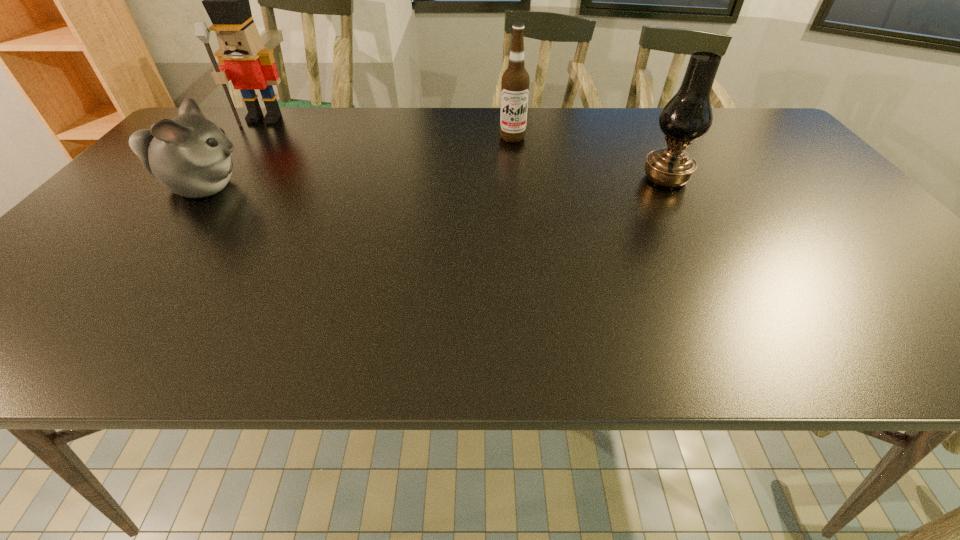
This screenshot has height=540, width=960. Find the location of `empty space that is in between the farthest object and the rightmost object`. empty space that is in between the farthest object and the rightmost object is located at coordinates (465, 149).

You are a GUI agent. You are given a task and a screenshot of the screen. Output one action in this format:
    pyautogui.click(x=<x>, y=<y>)
    Task: Click on the vacant area that lies between the oil lamp and the third object from left to right
    
    Given the screenshot: What is the action you would take?
    pyautogui.click(x=589, y=158)

Image resolution: width=960 pixels, height=540 pixels. In order to click on free space between the nutcracker and the hamster in this screenshot , I will do `click(233, 153)`.

Where is `empty space between the nutcracker and the rightmost object`? empty space between the nutcracker and the rightmost object is located at coordinates (465, 149).

Where is `vacant space that's between the second object from right to left and the rightmost object`? vacant space that's between the second object from right to left and the rightmost object is located at coordinates (589, 158).

Locate an element on the screen. vacant point located between the oil lamp and the third nearest object is located at coordinates (589, 158).

The height and width of the screenshot is (540, 960). Identify the location of unoccupied area between the farthest object and the alcohol. tap(389, 128).

Identify the location of free spot between the second farthest object and the rightmost object. This screenshot has height=540, width=960. (589, 158).

Select which object appears as the closest to the farthest object. Please provide its 2D coordinates. Your answer should be formatted as a tuple, i.e. [(x, y)], where the tuple contains the x and y coordinates of a point satisfying the conditions above.

[(189, 155)]

I want to click on object that ranks as the closest to the oil lamp, so click(x=515, y=82).